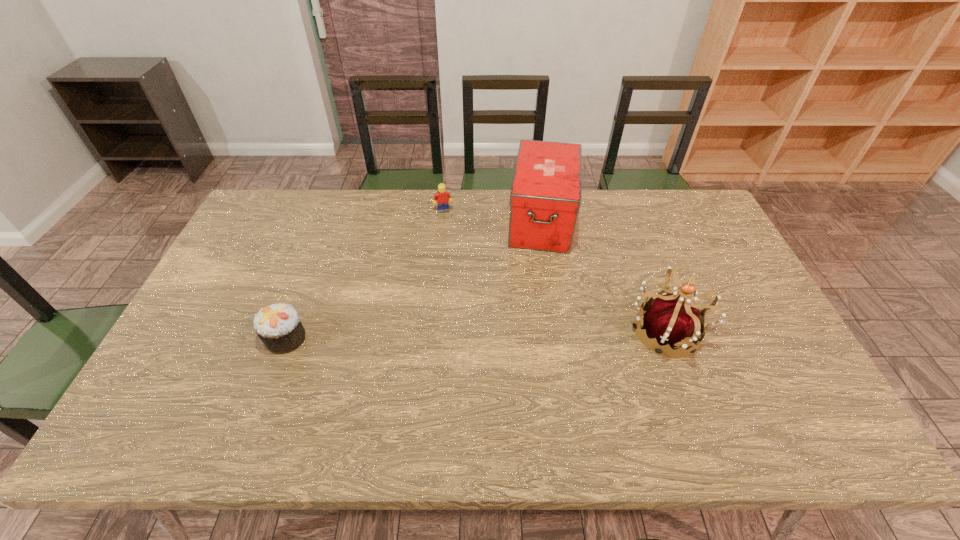
The image size is (960, 540). Identify the location of blank region between the third object from left to right and the leftmost object. (414, 279).

Locate an element on the screen. This screenshot has height=540, width=960. vacant region between the second object from right to left and the tiara is located at coordinates (603, 276).

The width and height of the screenshot is (960, 540). In order to click on vacant space in between the second object from right to left and the cupcake in this screenshot , I will do `click(414, 279)`.

Image resolution: width=960 pixels, height=540 pixels. Find the location of `blank region between the tiara and the Lego`. blank region between the tiara and the Lego is located at coordinates (553, 271).

The image size is (960, 540). I want to click on empty space between the rightmost object and the Lego, so click(x=553, y=271).

Find the location of a particular element. free space between the Lego and the tiara is located at coordinates (553, 271).

The image size is (960, 540). Identify the location of free space between the Lego and the cupcake. (365, 274).

Locate an element on the screen. empty location between the leftmost object and the rightmost object is located at coordinates (474, 335).

The width and height of the screenshot is (960, 540). I want to click on unoccupied position between the Lego and the first-aid kit, so click(x=492, y=215).

You are a GUI agent. You are given a task and a screenshot of the screen. Output one action in this format:
    pyautogui.click(x=<x>, y=<y>)
    Task: Click on the blank region between the second object from right to left and the tiara
    This screenshot has height=540, width=960.
    Given the screenshot: What is the action you would take?
    pyautogui.click(x=603, y=276)